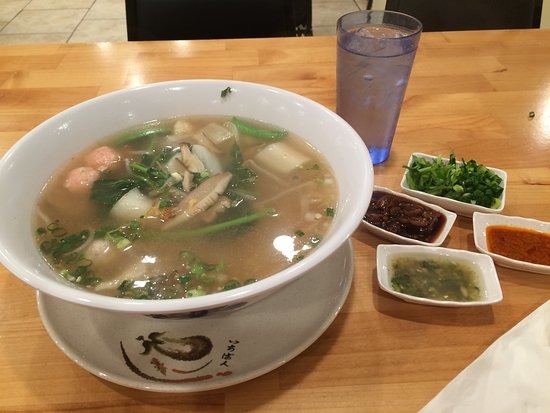
Locate an element on the screen. bowl is located at coordinates (276, 283).